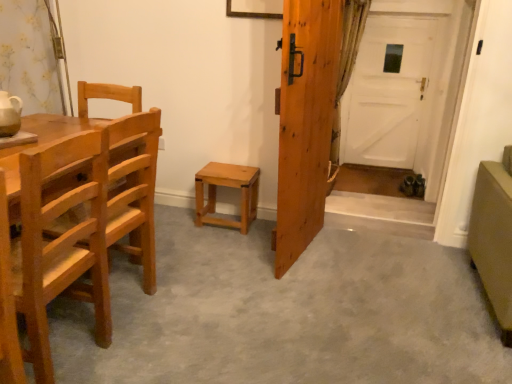
Identify the location of free spot to the right of light brown wood chair at left, the second chair when ordered from back to front. (161, 344).